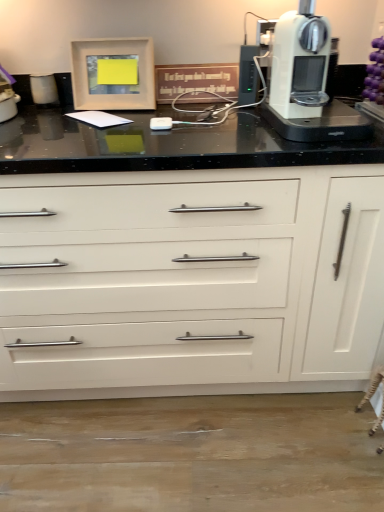
Question: Visually, is matte white trash can at left positioned to the left or to the right of white plastic coffee machine at upper right?

Choices:
 (A) left
 (B) right

Answer: (A)

Question: Looking at the image, does matte white trash can at left seem bigger or smaller compared to white plastic coffee machine at upper right?

Choices:
 (A) small
 (B) big

Answer: (A)

Question: Which object is the closest to the matte white picture frame at upper left?

Choices:
 (A) matte white trash can at left
 (B) white glossy cabinet at center
 (C) white plastic coffee machine at upper right

Answer: (A)

Question: Which of these objects is positioned farthest from the matte white picture frame at upper left?

Choices:
 (A) white plastic coffee machine at upper right
 (B) white glossy cabinet at center
 (C) matte white trash can at left

Answer: (B)